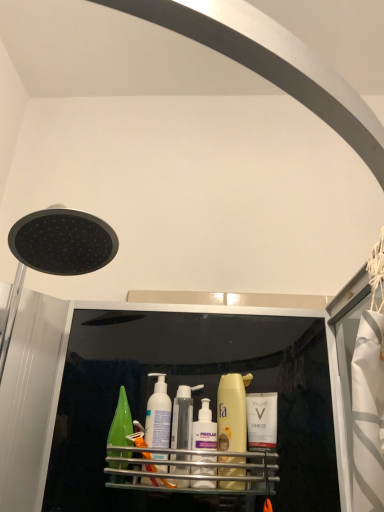
The image size is (384, 512). What do you see at coordinates (55, 252) in the screenshot? I see `black matte shower head at upper left` at bounding box center [55, 252].

At what (x,y) coordinates should I click in order to perform the action: click on matte yellow bottle at center, acting as the second cleaning product starting from the left. Please return your answer as a coordinate pair (x, y). The image size is (384, 512). Looking at the image, I should click on (232, 412).

In order to face white plastic pump bottle at center, marked as the 2th toiletry in a left-to-right arrangement, should I rotate leftwards or rightwards?

Rotate right and turn 1.392 degrees.

The image size is (384, 512). What do you see at coordinates (213, 470) in the screenshot?
I see `metallic silver shelf at center` at bounding box center [213, 470].

You are a GUI agent. You are given a task and a screenshot of the screen. Output one action in this format:
    pyautogui.click(x=<x>, y=<y>)
    Task: Click on the white matte pump bottle at center, the second cleaning product positioned from the right
    Image resolution: width=384 pixels, height=512 pixels.
    Given the screenshot: What is the action you would take?
    pyautogui.click(x=158, y=414)

The image size is (384, 512). Find the location of `translucent plastic bottles at center, the 3th toiletry in the right-to-left sequence`. translucent plastic bottles at center, the 3th toiletry in the right-to-left sequence is located at coordinates pyautogui.click(x=183, y=417).

Is metallic silver shelf at center shorter than white matte vichy bottle at center, the 1th toiletry in the right-to-left sequence?

Indeed, metallic silver shelf at center has a lesser height compared to white matte vichy bottle at center, the 1th toiletry in the right-to-left sequence.

Consider the image. Does metallic silver shelf at center turn towards white matte vichy bottle at center, marked as the 3th toiletry in a left-to-right arrangement?

No, metallic silver shelf at center does not turn towards white matte vichy bottle at center, marked as the 3th toiletry in a left-to-right arrangement.

Which is correct: metallic silver shelf at center is inside white matte vichy bottle at center, the 1th toiletry in the right-to-left sequence, or outside of it?

metallic silver shelf at center is located beyond the bounds of white matte vichy bottle at center, the 1th toiletry in the right-to-left sequence.

Considering the relative positions of translucent plastic bottles at center, placed as the first toiletry when sorted from left to right, and white plastic pump bottle at center, the second toiletry from the right, in the image provided, is translucent plastic bottles at center, placed as the first toiletry when sorted from left to right, to the left of white plastic pump bottle at center, the second toiletry from the right, from the viewer's perspective?

Yes, translucent plastic bottles at center, placed as the first toiletry when sorted from left to right, is to the left of white plastic pump bottle at center, the second toiletry from the right.

Is point (185, 459) behind point (197, 426)?

No, it is in front of (197, 426).

Which object is closer to the camera, translucent plastic bottles at center, the 3th toiletry in the right-to-left sequence, or white plastic pump bottle at center, marked as the 2th toiletry in a left-to-right arrangement?

Positioned in front is white plastic pump bottle at center, marked as the 2th toiletry in a left-to-right arrangement.

Considering the relative sizes of translucent plastic bottles at center, the 3th toiletry in the right-to-left sequence, and white plastic pump bottle at center, marked as the 2th toiletry in a left-to-right arrangement, in the image provided, is translucent plastic bottles at center, the 3th toiletry in the right-to-left sequence, taller than white plastic pump bottle at center, marked as the 2th toiletry in a left-to-right arrangement,?

Yes.

Is black matte shower head at upper left not close to translucent plastic bottles at center, the 3th toiletry in the right-to-left sequence?

No, there isn't a large distance between black matte shower head at upper left and translucent plastic bottles at center, the 3th toiletry in the right-to-left sequence.

Is point (64, 243) closer or farther from the camera than point (188, 407)?

Clearly, point (64, 243) is closer to the camera than point (188, 407).

Could you tell me if black matte shower head at upper left is turned towards translucent plastic bottles at center, placed as the first toiletry when sorted from left to right?

No, black matte shower head at upper left is not oriented towards translucent plastic bottles at center, placed as the first toiletry when sorted from left to right.

Is black matte shower head at upper left closer to camera compared to translucent plastic bottles at center, placed as the first toiletry when sorted from left to right?

Yes, black matte shower head at upper left is closer to the viewer.

How distant is metallic silver shelf at center from white matte pump bottle at center, the first cleaning product from the left?

metallic silver shelf at center and white matte pump bottle at center, the first cleaning product from the left, are 3.10 inches apart from each other.

Does metallic silver shelf at center have a smaller size compared to white matte pump bottle at center, the first cleaning product from the left?

Actually, metallic silver shelf at center might be larger than white matte pump bottle at center, the first cleaning product from the left.

Is metallic silver shelf at center inside the boundaries of white matte pump bottle at center, the first cleaning product from the left, or outside?

metallic silver shelf at center is not enclosed by white matte pump bottle at center, the first cleaning product from the left.

Considering the sizes of objects metallic silver shelf at center and white matte pump bottle at center, the first cleaning product from the left, in the image provided, who is shorter, metallic silver shelf at center or white matte pump bottle at center, the first cleaning product from the left,?

Standing shorter between the two is metallic silver shelf at center.

Which object is wider, matte yellow bottle at center, acting as the second cleaning product starting from the left, or white matte pump bottle at center, the second cleaning product positioned from the right?

matte yellow bottle at center, acting as the second cleaning product starting from the left.

From the image's perspective, is matte yellow bottle at center, acting as the second cleaning product starting from the left, beneath white matte pump bottle at center, the first cleaning product from the left?

Yes, from the image's perspective, matte yellow bottle at center, acting as the second cleaning product starting from the left, is below white matte pump bottle at center, the first cleaning product from the left.

Does matte yellow bottle at center, arranged as the first cleaning product when viewed from the right, have a greater height compared to white matte pump bottle at center, the second cleaning product positioned from the right?

Yes, matte yellow bottle at center, arranged as the first cleaning product when viewed from the right, is taller than white matte pump bottle at center, the second cleaning product positioned from the right.

The width and height of the screenshot is (384, 512). What are the coordinates of `toiletry behind the white matte pump bottle at center, the first cleaning product from the left` in the screenshot? It's located at (262, 420).

Which object is positioned more to the left, white matte vichy bottle at center, the 1th toiletry in the right-to-left sequence, or white matte pump bottle at center, the second cleaning product positioned from the right?

white matte pump bottle at center, the second cleaning product positioned from the right.

Considering the relative positions of white matte vichy bottle at center, marked as the 3th toiletry in a left-to-right arrangement, and white matte pump bottle at center, the first cleaning product from the left, in the image provided, is white matte vichy bottle at center, marked as the 3th toiletry in a left-to-right arrangement, behind white matte pump bottle at center, the first cleaning product from the left,?

Yes, the depth of white matte vichy bottle at center, marked as the 3th toiletry in a left-to-right arrangement, is greater than that of white matte pump bottle at center, the first cleaning product from the left.

Locate an element on the screen. This screenshot has height=512, width=384. cleaning product on the left of translucent plastic bottles at center, the 3th toiletry in the right-to-left sequence is located at coordinates (158, 414).

Are translucent plastic bottles at center, the 3th toiletry in the right-to-left sequence, and white matte pump bottle at center, the first cleaning product from the left, making contact?

Yes, the surface of translucent plastic bottles at center, the 3th toiletry in the right-to-left sequence, is in contact with white matte pump bottle at center, the first cleaning product from the left.

From a real-world perspective, is translucent plastic bottles at center, placed as the first toiletry when sorted from left to right, physically located above or below white matte pump bottle at center, the second cleaning product positioned from the right?

From a real-world perspective, translucent plastic bottles at center, placed as the first toiletry when sorted from left to right, is physically below white matte pump bottle at center, the second cleaning product positioned from the right.

From the image's perspective, which is below, translucent plastic bottles at center, placed as the first toiletry when sorted from left to right, or white matte pump bottle at center, the first cleaning product from the left?

translucent plastic bottles at center, placed as the first toiletry when sorted from left to right, appears lower in the image.

Image resolution: width=384 pixels, height=512 pixels. I want to click on the 2nd toiletry to the right of the metallic silver shelf at center, counting from the anchor's position, so click(x=262, y=420).

The height and width of the screenshot is (512, 384). I want to click on the 1st toiletry behind when counting from the white plastic pump bottle at center, marked as the 2th toiletry in a left-to-right arrangement, so pyautogui.click(x=183, y=417).

Consider the image. From the image, which object appears to be nearer to white matte vichy bottle at center, the 1th toiletry in the right-to-left sequence, black matte shower head at upper left or matte yellow bottle at center, acting as the second cleaning product starting from the left?

matte yellow bottle at center, acting as the second cleaning product starting from the left, is positioned closer to the anchor white matte vichy bottle at center, the 1th toiletry in the right-to-left sequence.

Looking at the image, which one is located closer to black matte shower head at upper left, white matte vichy bottle at center, marked as the 3th toiletry in a left-to-right arrangement, or matte yellow bottle at center, arranged as the first cleaning product when viewed from the right?

Based on the image, matte yellow bottle at center, arranged as the first cleaning product when viewed from the right, appears to be nearer to black matte shower head at upper left.

Which object lies further to the anchor point white plastic pump bottle at center, the second toiletry from the right, black matte shower head at upper left or translucent plastic bottles at center, placed as the first toiletry when sorted from left to right?

black matte shower head at upper left.

From the image, which object appears to be farther from white matte vichy bottle at center, the 1th toiletry in the right-to-left sequence, white matte pump bottle at center, the first cleaning product from the left, or white plastic pump bottle at center, the second toiletry from the right?

white matte pump bottle at center, the first cleaning product from the left, is positioned further to the anchor white matte vichy bottle at center, the 1th toiletry in the right-to-left sequence.

Estimate the real-world distances between objects in this image. Which object is further from black matte shower head at upper left, translucent plastic bottles at center, placed as the first toiletry when sorted from left to right, or white plastic pump bottle at center, the second toiletry from the right?

The object further to black matte shower head at upper left is white plastic pump bottle at center, the second toiletry from the right.

From the image, which object appears to be nearer to white matte vichy bottle at center, the 1th toiletry in the right-to-left sequence, matte yellow bottle at center, acting as the second cleaning product starting from the left, or translucent plastic bottles at center, placed as the first toiletry when sorted from left to right?

The object closer to white matte vichy bottle at center, the 1th toiletry in the right-to-left sequence, is matte yellow bottle at center, acting as the second cleaning product starting from the left.

Considering their positions, is white plastic pump bottle at center, marked as the 2th toiletry in a left-to-right arrangement, positioned further to white matte vichy bottle at center, the 1th toiletry in the right-to-left sequence, than white matte pump bottle at center, the second cleaning product positioned from the right?

white matte pump bottle at center, the second cleaning product positioned from the right, lies further to white matte vichy bottle at center, the 1th toiletry in the right-to-left sequence, than the other object.

Looking at the image, which one is located closer to white matte pump bottle at center, the second cleaning product positioned from the right, metallic silver shelf at center or matte yellow bottle at center, acting as the second cleaning product starting from the left?

metallic silver shelf at center is positioned closer to the anchor white matte pump bottle at center, the second cleaning product positioned from the right.

This screenshot has width=384, height=512. I want to click on toiletry between white matte pump bottle at center, the second cleaning product positioned from the right, and white plastic pump bottle at center, marked as the 2th toiletry in a left-to-right arrangement, from left to right, so click(183, 417).

I want to click on shelf situated between black matte shower head at upper left and white matte vichy bottle at center, the 1th toiletry in the right-to-left sequence, from left to right, so click(x=213, y=470).

The width and height of the screenshot is (384, 512). Identify the location of cleaning product located between translucent plastic bottles at center, the 3th toiletry in the right-to-left sequence, and white matte vichy bottle at center, the 1th toiletry in the right-to-left sequence, in the left-right direction. (232, 412).

Image resolution: width=384 pixels, height=512 pixels. Identify the location of shelf between translucent plastic bottles at center, the 3th toiletry in the right-to-left sequence, and matte yellow bottle at center, acting as the second cleaning product starting from the left. pos(213,470).